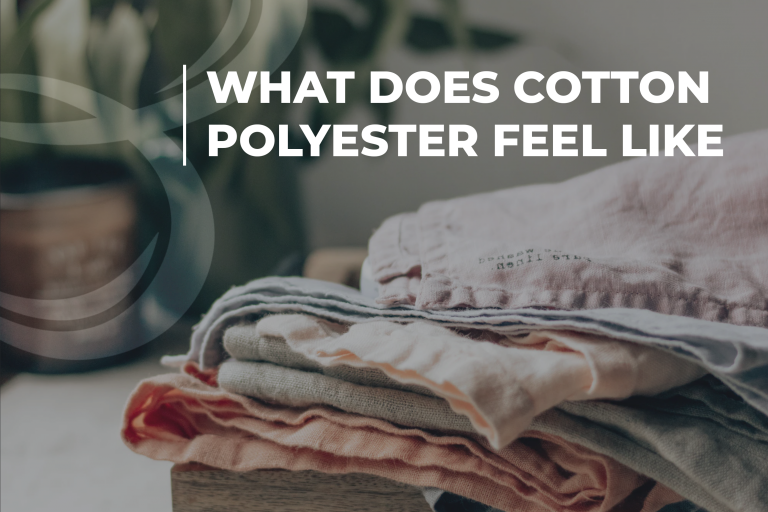
Image resolution: width=768 pixels, height=512 pixels. I want to click on white counter top, so click(138, 373).